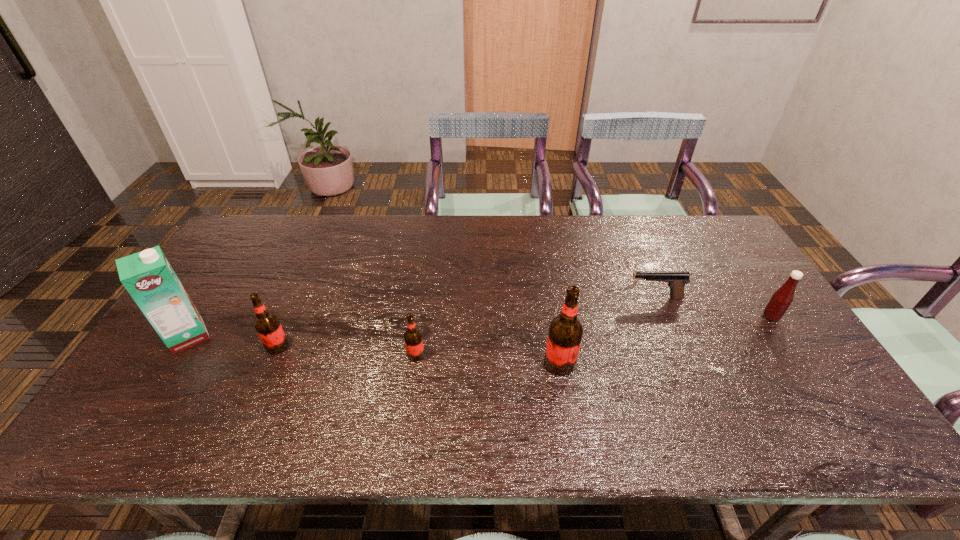
You are a GUI agent. You are given a task and a screenshot of the screen. Output one action in this format:
    pyautogui.click(x=<x>, y=<y>)
    Task: Click on the object located in the right edge section of the desktop
    The image size is (960, 540).
    Given the screenshot: What is the action you would take?
    pyautogui.click(x=780, y=301)

Where is `free region at the far edge of the desktop`? This screenshot has width=960, height=540. free region at the far edge of the desktop is located at coordinates (459, 220).

Identify the location of free space at the near edge of the desktop. The image size is (960, 540). (750, 395).

Locate an element on the screen. free location at the left edge of the desktop is located at coordinates (236, 308).

The height and width of the screenshot is (540, 960). Find the location of `vacant point at the right edge`. vacant point at the right edge is located at coordinates [753, 363].

Where is `vacant space at the far left corner of the desktop`? vacant space at the far left corner of the desktop is located at coordinates (252, 230).

Where is `vacant space in between the rightmost object and the leftmost object`? The height and width of the screenshot is (540, 960). vacant space in between the rightmost object and the leftmost object is located at coordinates (479, 326).

Locate an element on the screen. vacant area between the fifth object from right to left and the leftmost object is located at coordinates (232, 341).

Locate an element on the screen. Image resolution: width=960 pixels, height=540 pixels. free space between the fifth object from right to left and the pistol is located at coordinates (467, 322).

Where is `free space between the leftmost root beer and the leftmost object`? free space between the leftmost root beer and the leftmost object is located at coordinates (232, 341).